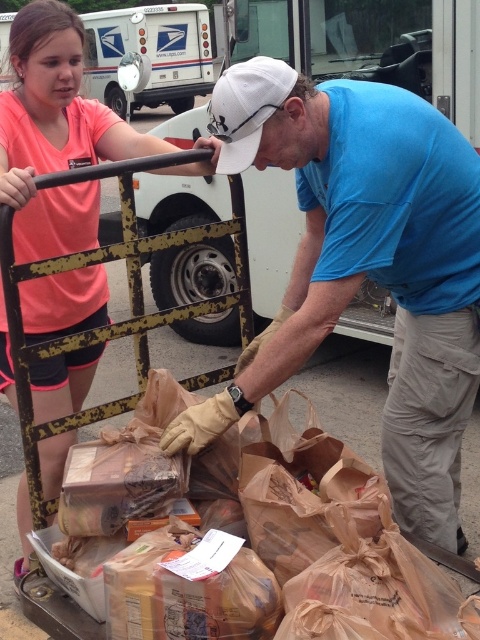
Question: Is blue t-shirt at center closer to the viewer compared to pink fabric shirt at upper left?

Choices:
 (A) no
 (B) yes

Answer: (A)

Question: Does blue t-shirt at center have a larger size compared to pink fabric shirt at upper left?

Choices:
 (A) no
 (B) yes

Answer: (A)

Question: Can you confirm if blue t-shirt at center is positioned to the left of pink fabric shirt at upper left?

Choices:
 (A) no
 (B) yes

Answer: (A)

Question: Among these points, which one is farthest from the camera?

Choices:
 (A) (446, 248)
 (B) (66, 29)

Answer: (B)